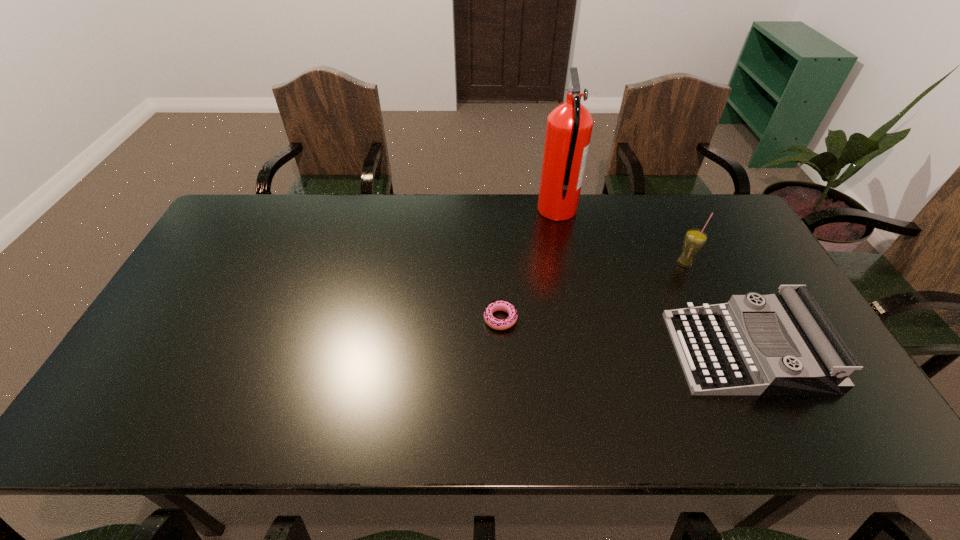
At what (x,y) coordinates should I click in order to perform the action: click on fire extinguisher. Please return your answer as a coordinate pair (x, y). The width and height of the screenshot is (960, 540). Looking at the image, I should click on (569, 127).

Identify the location of the tallest object. (569, 127).

The image size is (960, 540). I want to click on straw for drinking, so click(x=694, y=240).

You are a GUI agent. You are given a task and a screenshot of the screen. Output one action in this format:
    pyautogui.click(x=<x>, y=<y>)
    Task: Click on the third nearest object
    
    Given the screenshot: What is the action you would take?
    pyautogui.click(x=694, y=240)

The width and height of the screenshot is (960, 540). What are the coordinates of `typewriter` in the screenshot? It's located at (779, 344).

The height and width of the screenshot is (540, 960). Identify the location of the leftmost object. (502, 305).

Find the location of a particular element. doughnut is located at coordinates (502, 305).

The width and height of the screenshot is (960, 540). I want to click on vacant space located at the nozzle of the farthest object, so click(x=436, y=211).

Find the location of `vacant space positioned at the nozzle of the farthest object`. vacant space positioned at the nozzle of the farthest object is located at coordinates (439, 211).

Identify the location of vacant space located at the nozzle of the farthest object. This screenshot has height=540, width=960. (421, 211).